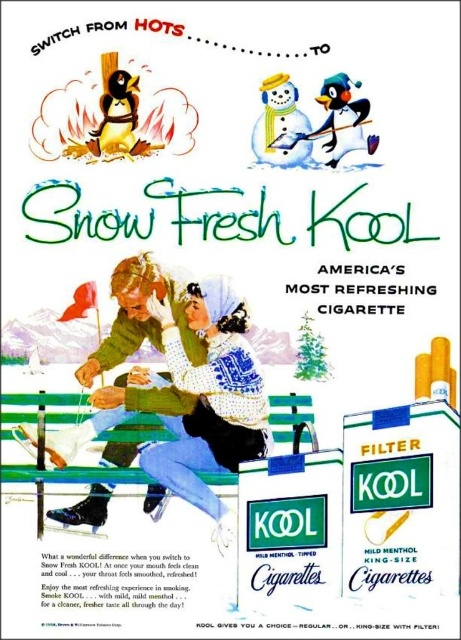
Question: Can you confirm if green wooden bench at center is smaller than white paper snowman at upper center?

Choices:
 (A) yes
 (B) no

Answer: (A)

Question: Which point is farther to the camera?

Choices:
 (A) green wooden bench at center
 (B) green knitted sweater at center
 (C) white paper snowman at upper center

Answer: (C)

Question: Which point is closer to the camera?

Choices:
 (A) white paper snowman at upper center
 (B) green knitted sweater at center

Answer: (B)

Question: Does green knitted sweater at center appear on the right side of white paper snowman at upper center?

Choices:
 (A) no
 (B) yes

Answer: (A)

Question: In this image, where is green wooden bench at center located relative to white matte snowman at upper center?

Choices:
 (A) above
 (B) below

Answer: (B)

Question: Which point is closer to the camera taking this photo?

Choices:
 (A) (300, 132)
 (B) (373, 145)
 (C) (230, 476)

Answer: (C)